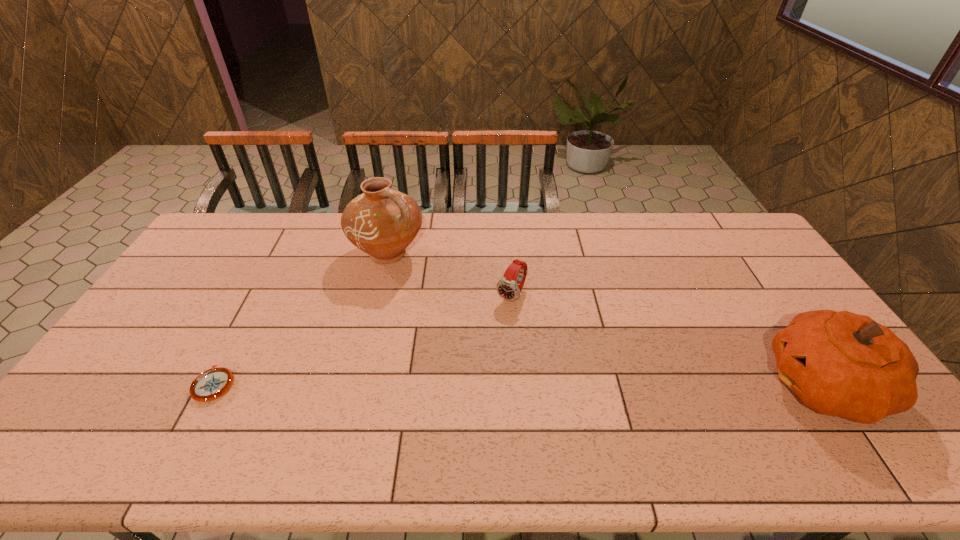
Identify the location of free spot on the desktop that is between the shortest object and the second tallest object and is positioned on the face of the watch. (449, 384).

Where is `vacant space on the desktop that is between the leftmost object and the pumpkin and is positioned on the side of the tallest object with the handle`? This screenshot has height=540, width=960. vacant space on the desktop that is between the leftmost object and the pumpkin and is positioned on the side of the tallest object with the handle is located at coordinates (567, 384).